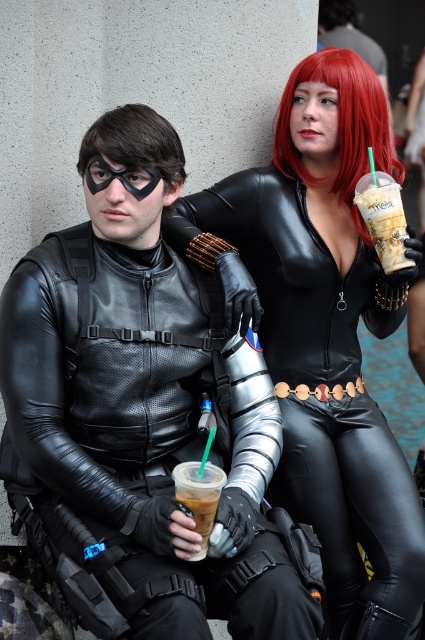
What is located at the point with coordinates (198, 497) in the image?

The point at coordinates (198, 497) contains iced coffee at lower center.